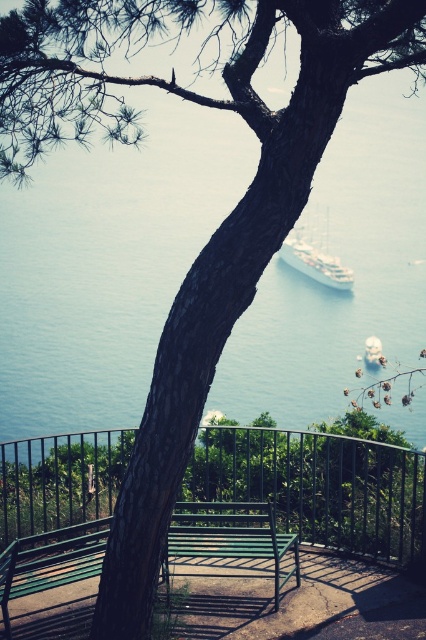
In the scene shown: You are a visitor at the coastal area and want to sit on the green metal bench at center. However, there is a green metal fence at center in the way. Can you sit on the bench without moving the fence?

The green metal fence at center has a larger size compared to green metal bench at center, so the fence is blocking the path to the bench. Therefore, you cannot sit on the green metal bench at center without moving the fence.

From the picture: You are designing a new bench to place near the white glossy ship at center. The existing green metal bench at lower left is only 20 cm thick. What minimum thickness should your new bench have to be thicker than the existing one?

The green metal bench at lower left is thinner than the white glossy ship at center. To ensure the new bench is thicker than the existing one, it should be at least 21 cm thick.

You are standing at the curved metal bench with green painted metal supports on the concrete platform. Looking towards the sea, you notice a point marked at coordinates [319,486]. What object is located at that point?

The point at coordinates [319,486] indicates a green metal fence at center.